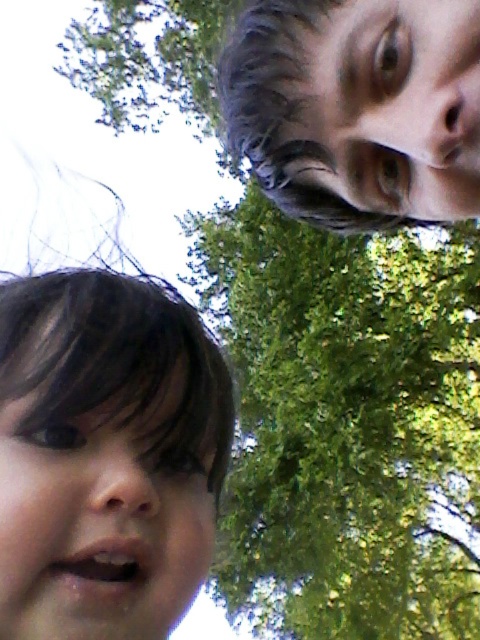
Question: Among these objects, which one is nearest to the camera?

Choices:
 (A) smooth skin face at bottom left
 (B) smooth skin face at upper right

Answer: (A)

Question: Among these objects, which one is nearest to the camera?

Choices:
 (A) smooth skin face at upper right
 (B) smooth skin face at bottom left

Answer: (B)

Question: Can you confirm if smooth skin face at bottom left is positioned above smooth skin face at upper right?

Choices:
 (A) no
 (B) yes

Answer: (A)

Question: Can you confirm if smooth skin face at bottom left is positioned below smooth skin face at upper right?

Choices:
 (A) no
 (B) yes

Answer: (B)

Question: Can you confirm if smooth skin face at bottom left is wider than smooth skin face at upper right?

Choices:
 (A) yes
 (B) no

Answer: (A)